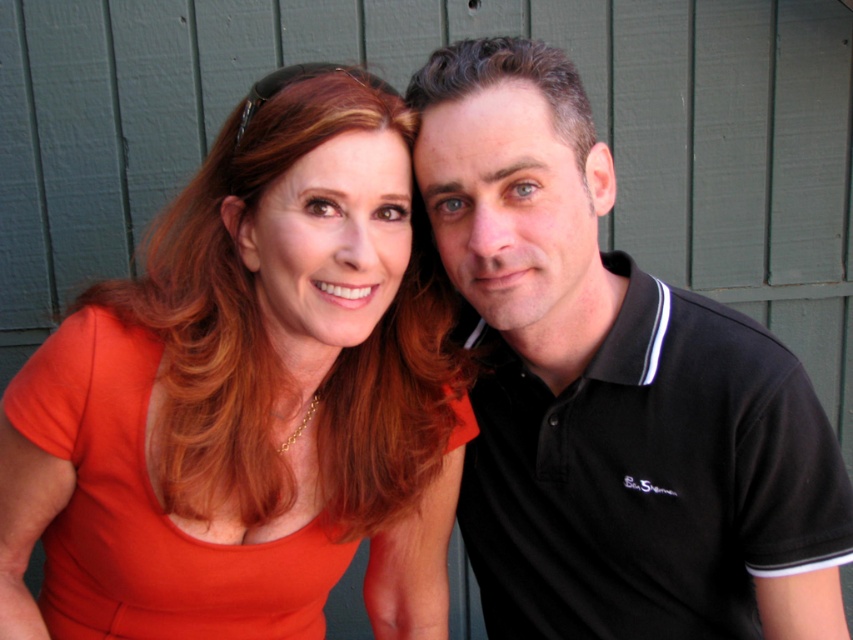
Question: Can you confirm if orange matte dress at center is positioned to the right of black cotton polo shirt at right?

Choices:
 (A) yes
 (B) no

Answer: (B)

Question: Which point is farther to the camera?

Choices:
 (A) black cotton polo shirt at right
 (B) orange matte dress at center

Answer: (A)

Question: Which of the following is the farthest from the observer?

Choices:
 (A) (54, 412)
 (B) (490, 452)

Answer: (B)

Question: Where is orange matte dress at center located in relation to black cotton polo shirt at right in the image?

Choices:
 (A) above
 (B) below

Answer: (B)

Question: Among these points, which one is nearest to the camera?

Choices:
 (A) (426, 294)
 (B) (558, 227)

Answer: (B)

Question: Does orange matte dress at center have a lesser width compared to black cotton polo shirt at right?

Choices:
 (A) no
 (B) yes

Answer: (A)